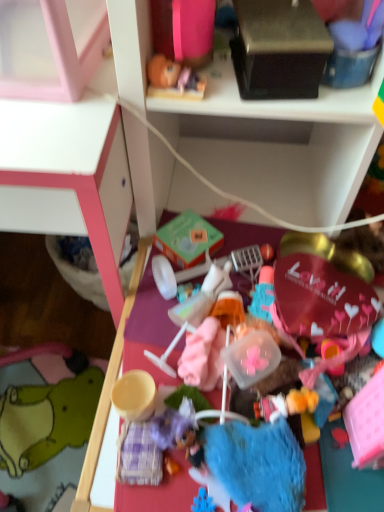
Question: From the image's perspective, is green felt plush at lower left located above white plastic shelf at upper center?

Choices:
 (A) no
 (B) yes

Answer: (A)

Question: From a real-world perspective, is green felt plush at lower left located beneath white plastic shelf at upper center?

Choices:
 (A) yes
 (B) no

Answer: (A)

Question: From a real-world perspective, is green felt plush at lower left on top of white plastic shelf at upper center?

Choices:
 (A) yes
 (B) no

Answer: (B)

Question: Is green felt plush at lower left positioned in front of white plastic shelf at upper center?

Choices:
 (A) no
 (B) yes

Answer: (A)

Question: Considering the relative sizes of green felt plush at lower left and white plastic shelf at upper center in the image provided, is green felt plush at lower left bigger than white plastic shelf at upper center?

Choices:
 (A) yes
 (B) no

Answer: (B)

Question: Is green felt plush at lower left wider or thinner than plastic toy at center?

Choices:
 (A) wide
 (B) thin

Answer: (A)

Question: From the image's perspective, is green felt plush at lower left above or below plastic toy at center?

Choices:
 (A) above
 (B) below

Answer: (B)

Question: Considering the relative positions of green felt plush at lower left and plastic toy at center in the image provided, is green felt plush at lower left to the left or to the right of plastic toy at center?

Choices:
 (A) right
 (B) left

Answer: (B)

Question: In terms of size, does green felt plush at lower left appear bigger or smaller than plastic toy at center?

Choices:
 (A) small
 (B) big

Answer: (B)

Question: Is green felt plush at lower left in front of or behind white plastic shelf at upper center in the image?

Choices:
 (A) front
 (B) behind

Answer: (B)

Question: Is green felt plush at lower left to the left or to the right of white plastic shelf at upper center in the image?

Choices:
 (A) left
 (B) right

Answer: (A)

Question: Is green felt plush at lower left spatially inside white plastic shelf at upper center, or outside of it?

Choices:
 (A) outside
 (B) inside

Answer: (A)

Question: From a real-world perspective, is green felt plush at lower left physically located above or below white plastic shelf at upper center?

Choices:
 (A) above
 (B) below

Answer: (B)

Question: From a real-world perspective, is white plastic shelf at upper center positioned above or below black matte box at upper center?

Choices:
 (A) above
 (B) below

Answer: (B)

Question: Considering the positions of white plastic shelf at upper center and black matte box at upper center in the image, is white plastic shelf at upper center taller or shorter than black matte box at upper center?

Choices:
 (A) tall
 (B) short

Answer: (A)